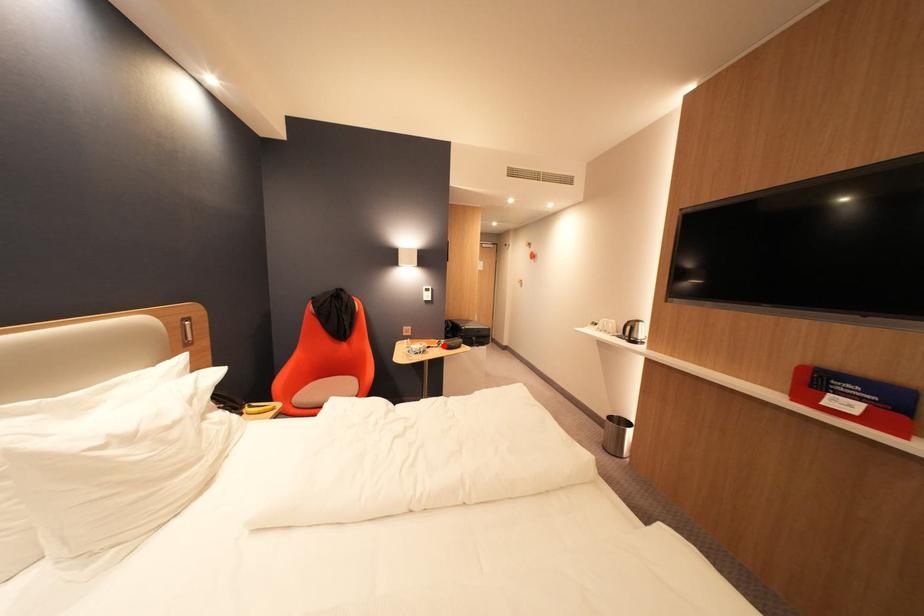
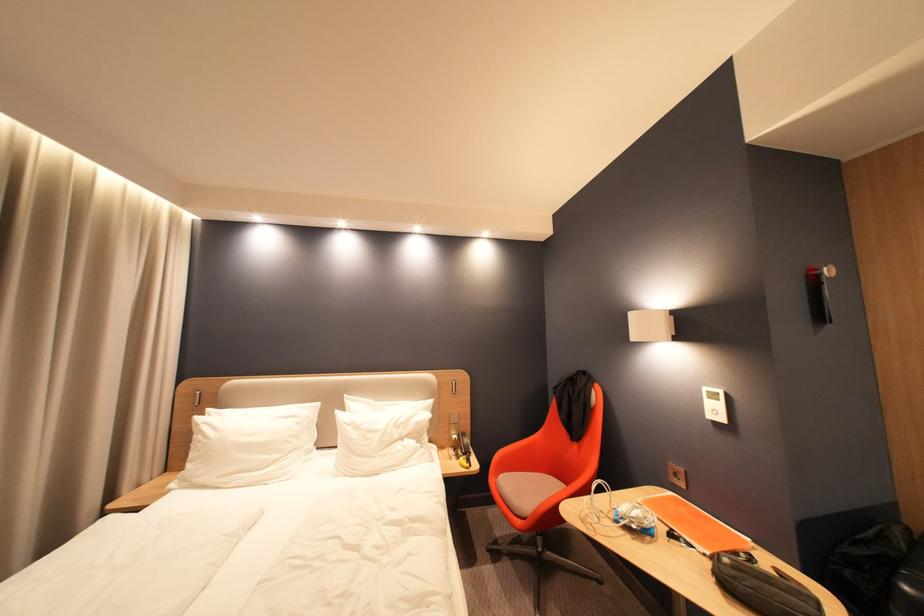
The point at the highlighted location is marked in the first image. Where is the corresponding point in the second image?

(710, 544)